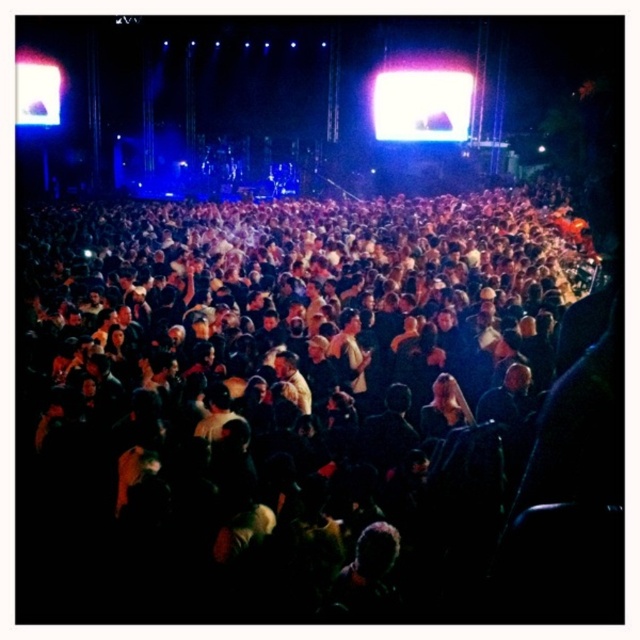
Is dark matte crowd at center to the left of white glossy screen at upper left from the viewer's perspective?

In fact, dark matte crowd at center is to the right of white glossy screen at upper left.

Which is in front, point (433, 468) or point (16, 109)?

Positioned in front is point (433, 468).

You are a GUI agent. You are given a task and a screenshot of the screen. Output one action in this format:
    pyautogui.click(x=<x>, y=<y>)
    Task: Click on the dark matte crowd at center
    The image size is (640, 640).
    Given the screenshot: What is the action you would take?
    pyautogui.click(x=284, y=397)

Consider the image. Does dark matte crowd at center have a greater width compared to bright white screen at upper center?

Yes.

Which of these two, dark matte crowd at center or bright white screen at upper center, stands taller?

Standing taller between the two is dark matte crowd at center.

Identify the location of dark matte crowd at center. Image resolution: width=640 pixels, height=640 pixels. (284, 397).

Does bright white screen at upper center have a greater width compared to white glossy screen at upper left?

Yes.

Which of these two, bright white screen at upper center or white glossy screen at upper left, stands taller?

bright white screen at upper center

Identify the location of bright white screen at upper center. The width and height of the screenshot is (640, 640). (422, 106).

You are a GUI agent. You are given a task and a screenshot of the screen. Output one action in this format:
    pyautogui.click(x=<x>, y=<y>)
    Task: Click on the bright white screen at upper center
    The height and width of the screenshot is (640, 640).
    Given the screenshot: What is the action you would take?
    pyautogui.click(x=422, y=106)